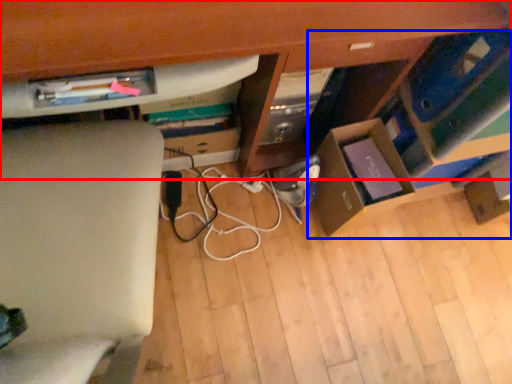
Question: Which object is closer to the camera taking this photo, computer desk (highlighted by a red box) or shelf (highlighted by a blue box)?

Choices:
 (A) computer desk
 (B) shelf

Answer: (A)